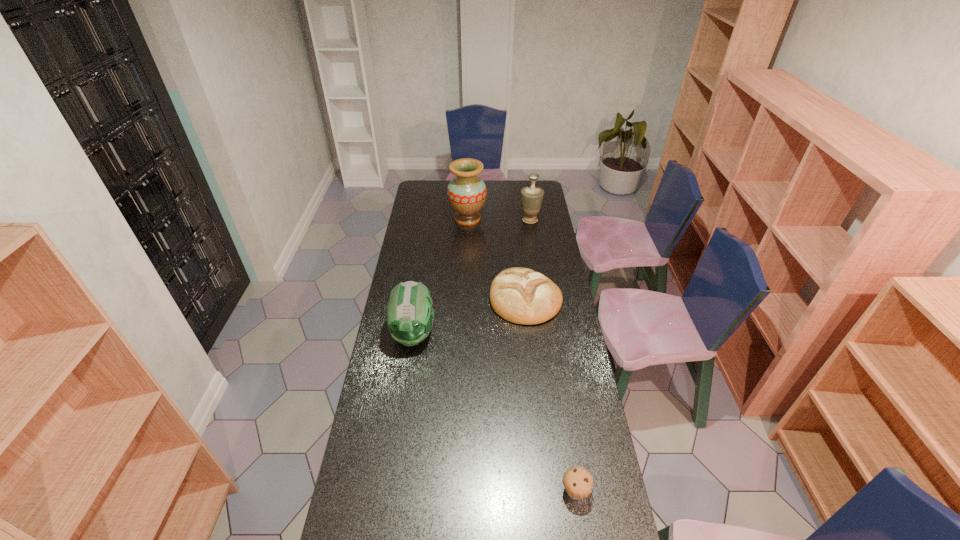
The image size is (960, 540). I want to click on free space located 0.190m on the visor of the leftmost object, so click(403, 397).

Find the location of a particular element. free space located 0.150m on the back of the bread is located at coordinates (520, 255).

At what (x,y) coordinates should I click in order to perform the action: click on blank space located on the right of the muffin. Please return your answer as a coordinate pair (x, y). The image size is (960, 540). Looking at the image, I should click on (612, 491).

In order to click on object that is at the left edge in this screenshot , I will do `click(410, 314)`.

Locate an element on the screen. urn at the right edge is located at coordinates (531, 196).

At what (x,y) coordinates should I click in order to perform the action: click on bread present at the right edge. Please return your answer as a coordinate pair (x, y). Looking at the image, I should click on (520, 295).

You are a GUI agent. You are given a task and a screenshot of the screen. Output one action in this format:
    pyautogui.click(x=<x>, y=<y>)
    Task: Click on the muffin located in the right edge section of the desktop
    
    Given the screenshot: What is the action you would take?
    pyautogui.click(x=577, y=481)

You are a GUI agent. You are given a task and a screenshot of the screen. Output one action in this format:
    pyautogui.click(x=<x>, y=<y>)
    Task: Click on the vacant area at the far edge
    
    Given the screenshot: What is the action you would take?
    pyautogui.click(x=487, y=188)

In order to click on free space at the left edge of the desktop in this screenshot , I will do `click(411, 355)`.

Locate an element on the screen. vacant space at the right edge is located at coordinates (552, 259).